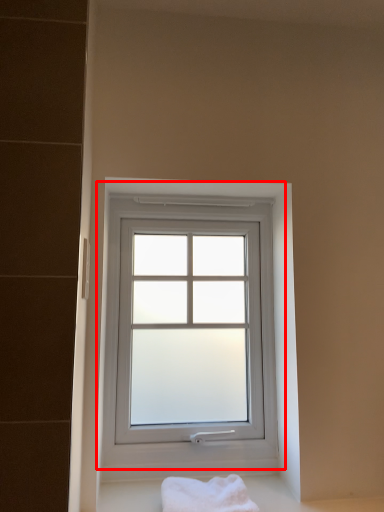
Question: Observing the image, what is the correct spatial positioning of window (annotated by the red box) in reference to bath towel?

Choices:
 (A) right
 (B) left

Answer: (B)